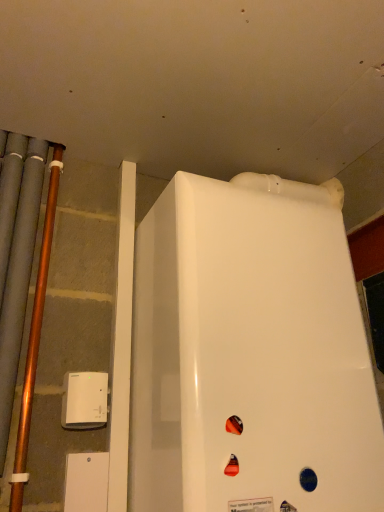
Question: Is white glossy refrigerator at center shorter than white plastic device at lower left?

Choices:
 (A) no
 (B) yes

Answer: (A)

Question: Does white glossy refrigerator at center have a smaller size compared to white plastic device at lower left?

Choices:
 (A) no
 (B) yes

Answer: (A)

Question: From a real-world perspective, does white glossy refrigerator at center stand above white plastic device at lower left?

Choices:
 (A) yes
 (B) no

Answer: (A)

Question: Can white plastic device at lower left be found inside white glossy refrigerator at center?

Choices:
 (A) yes
 (B) no

Answer: (B)

Question: Is white glossy refrigerator at center at the right side of white plastic device at lower left?

Choices:
 (A) no
 (B) yes

Answer: (B)

Question: From the image's perspective, is white plastic device at lower left above or below white glossy refrigerator at center?

Choices:
 (A) above
 (B) below

Answer: (B)

Question: Is point (79, 415) closer or farther from the camera than point (190, 306)?

Choices:
 (A) closer
 (B) farther

Answer: (B)

Question: Considering the positions of white plastic device at lower left and white glossy refrigerator at center in the image, is white plastic device at lower left bigger or smaller than white glossy refrigerator at center?

Choices:
 (A) big
 (B) small

Answer: (B)

Question: From a real-world perspective, is white plastic device at lower left positioned above or below white glossy refrigerator at center?

Choices:
 (A) below
 (B) above

Answer: (A)

Question: Based on their sizes in the image, would you say white plastic device at lower left is bigger or smaller than copper metallic pipe at left?

Choices:
 (A) small
 (B) big

Answer: (A)

Question: Considering the positions of white plastic device at lower left and copper metallic pipe at left in the image, is white plastic device at lower left taller or shorter than copper metallic pipe at left?

Choices:
 (A) short
 (B) tall

Answer: (A)

Question: Would you say white plastic device at lower left is to the left or to the right of copper metallic pipe at left in the picture?

Choices:
 (A) left
 (B) right

Answer: (B)

Question: Relative to copper metallic pipe at left, is white plastic device at lower left in front or behind?

Choices:
 (A) front
 (B) behind

Answer: (B)

Question: Is white glossy refrigerator at center bigger or smaller than copper metallic pipe at left?

Choices:
 (A) big
 (B) small

Answer: (A)

Question: From a real-world perspective, is white glossy refrigerator at center physically located above or below copper metallic pipe at left?

Choices:
 (A) below
 (B) above

Answer: (A)